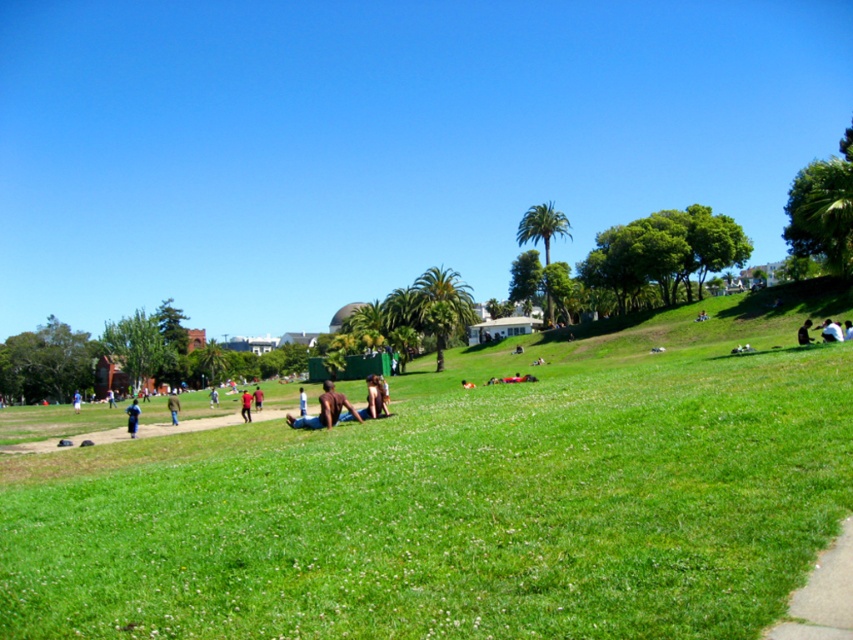
You are standing at the point with coordinates point (132, 420) and want to walk towards the point with coordinates point (804, 321). Will you walk towards a direction that is closer to the foreground or background of the image?

Since point (132, 420) is in front of point (804, 321), walking from point (132, 420) towards point (804, 321) means you are moving towards the background of the image.

You are a photographer trying to capture a candid shot of the blue fabric shirt at lower left and the dark blue jeans at lower right. Which object is wider in the image?

The blue fabric shirt at lower left is wider than the dark blue jeans at lower right according to the description.

You are a photographer taking a picture of the light brown skin at center and the blue fabric shirt at center. Which object is positioned higher in the frame?

The light brown skin at center is positioned higher than the blue fabric shirt at center in the frame.